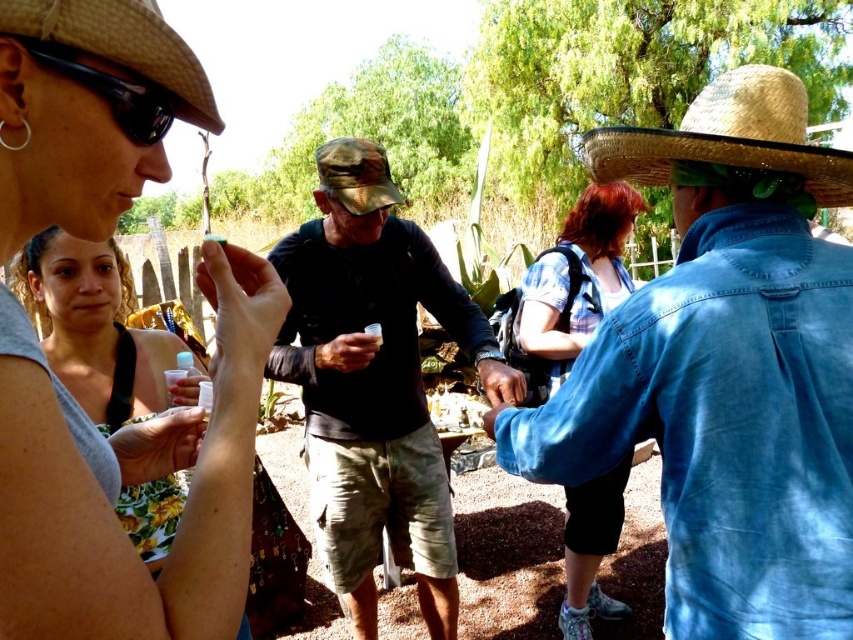
You are standing at the origin of the coordinate system in the image. You see a denim jacket at upper right located at point (724,369). If you want to walk towards the denim jacket at upper right, in which direction should you move?

You should move towards the upper right direction to reach the denim jacket at upper right located at point (724,369).

You are standing at the origin point of the coordinate system in the image. You want to move towards the denim jacket at upper right. What direction should you move in to reach it?

The denim jacket at upper right is located at coordinate point 0.577 on the x axis and 0.851 on the y axis. Since you are at the origin, you should move towards the upper right direction to reach it.

You are a photographer trying to capture a photo of the camouflage fabric hat at center and the plaid shirt at center. Based on their positions, which one should you focus on first if you want to include both in the frame without moving the camera?

The camouflage fabric hat at center is below the plaid shirt at center, so you should focus on the plaid shirt at center first to ensure both are in the frame without moving the camera.